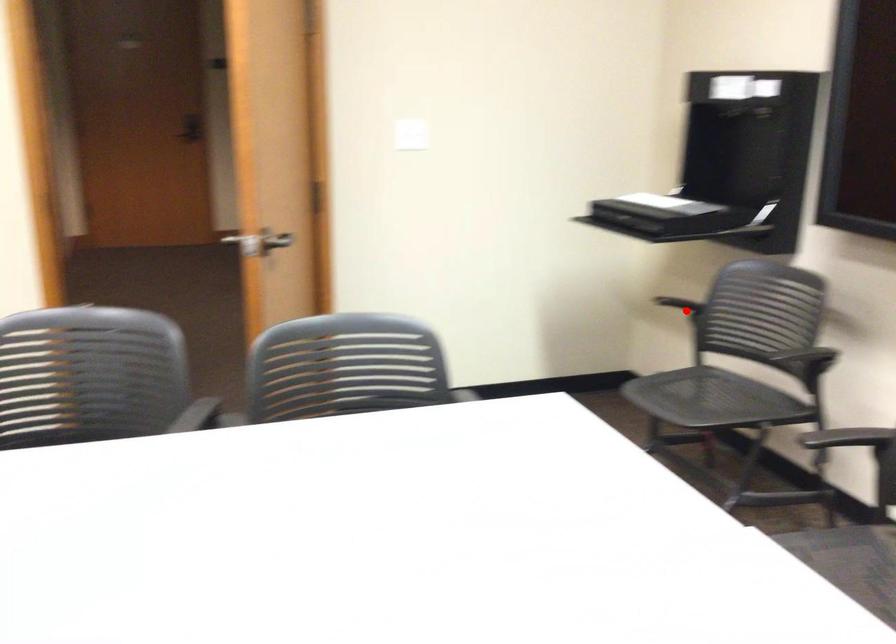
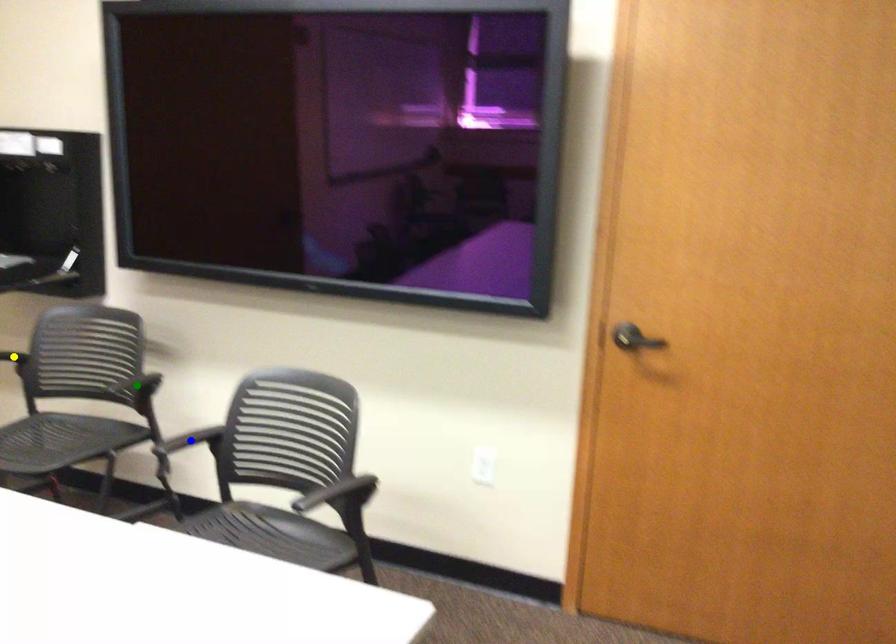
Question: I am providing you with two images of the same scene from different viewpoints. A red point is marked on the first image. You are given multiple points on the second image. In image 2, which mark is for the same physical point as the one in image 1?

Choices:
 (A) green point
 (B) blue point
 (C) yellow point

Answer: (C)